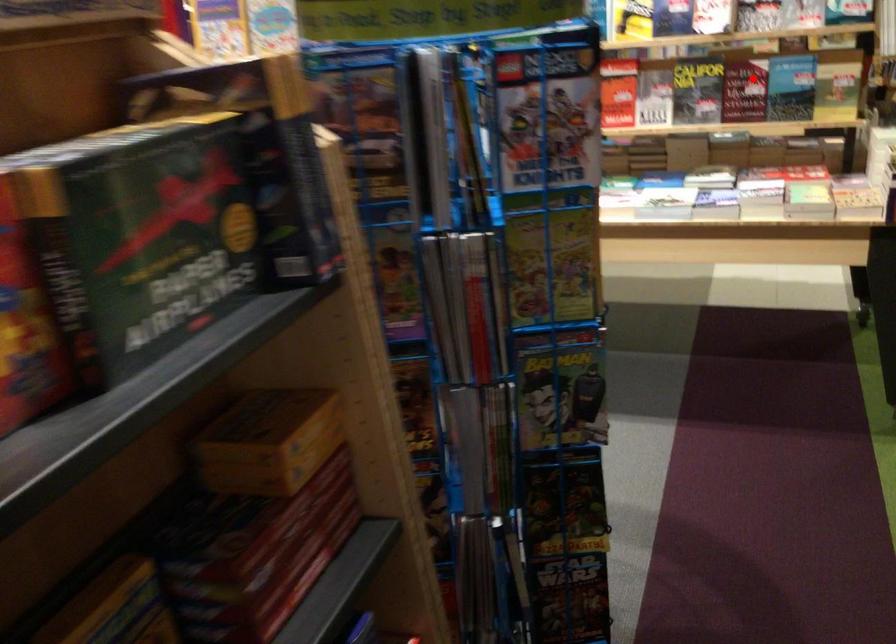
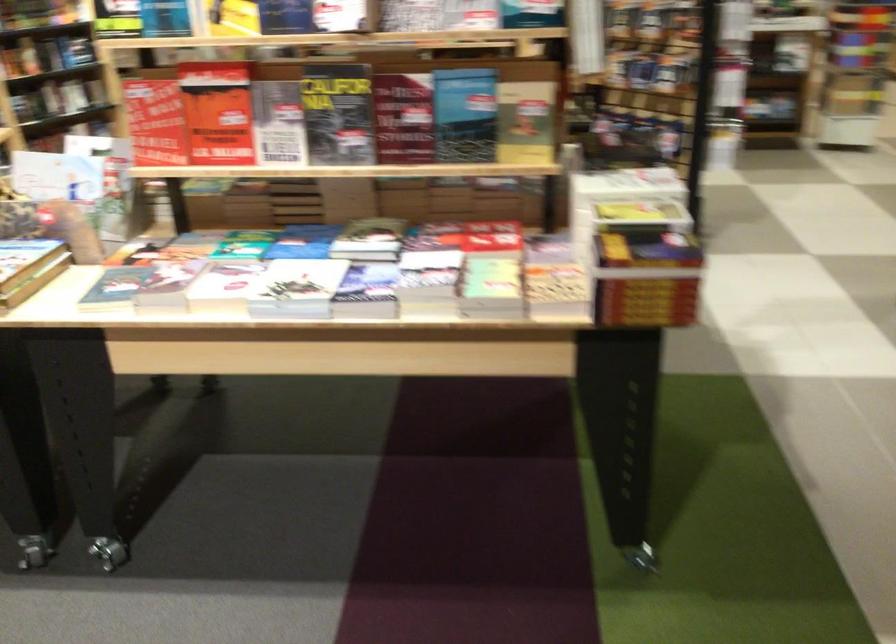
The point at the highlighted location is marked in the first image. Where is the corresponding point in the second image?

(403, 118)